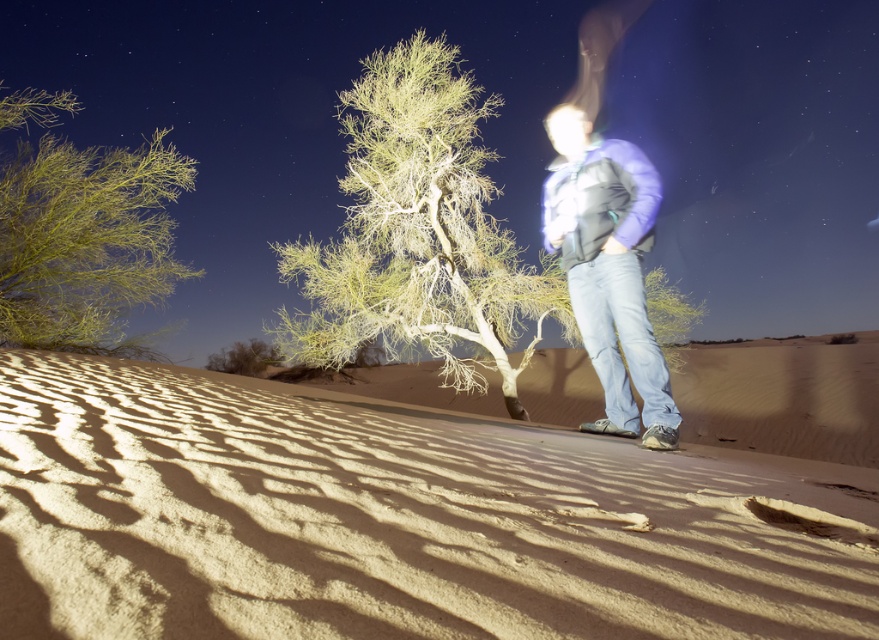
Who is positioned more to the right, smooth sand at center or green leafy shrub at left?

smooth sand at center is more to the right.

Which of these two, smooth sand at center or green leafy shrub at left, stands shorter?

smooth sand at center

Locate an element on the screen. Image resolution: width=879 pixels, height=640 pixels. smooth sand at center is located at coordinates coord(393,518).

Where is `smooth sand at center`? This screenshot has width=879, height=640. smooth sand at center is located at coordinates (393, 518).

Does green leafy shrub at left come in front of purple fleece jacket at center?

No.

Is green leafy shrub at left to the left of purple fleece jacket at center from the viewer's perspective?

Yes, green leafy shrub at left is to the left of purple fleece jacket at center.

Does point (97, 234) come closer to viewer compared to point (558, 156)?

Yes, it is.

At what (x,y) coordinates should I click in order to perform the action: click on green leafy shrub at left. Please return your answer as a coordinate pair (x, y). The height and width of the screenshot is (640, 879). Looking at the image, I should click on (85, 243).

Which is below, smooth sand at center or green leafy tree at center?

smooth sand at center is lower down.

Which is in front, point (389, 433) or point (607, 228)?

Positioned in front is point (389, 433).

Find the location of a particular element. The height and width of the screenshot is (640, 879). smooth sand at center is located at coordinates (393, 518).

The width and height of the screenshot is (879, 640). Find the location of `smooth sand at center`. smooth sand at center is located at coordinates (393, 518).